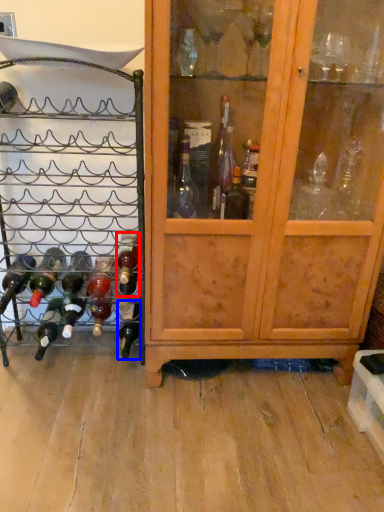
Question: Which object is closer to the camera taking this photo, bottle (highlighted by a red box) or bottle (highlighted by a blue box)?

Choices:
 (A) bottle
 (B) bottle

Answer: (A)